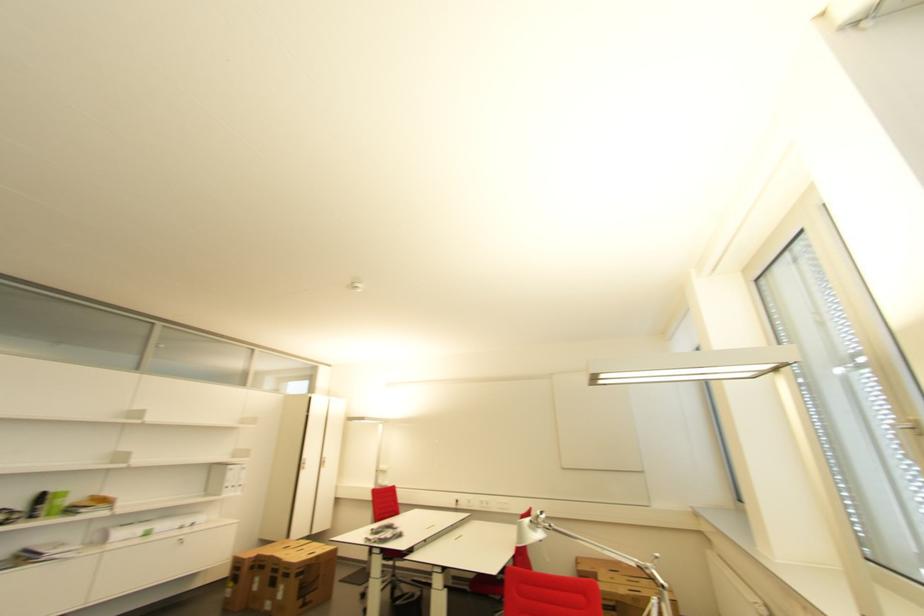
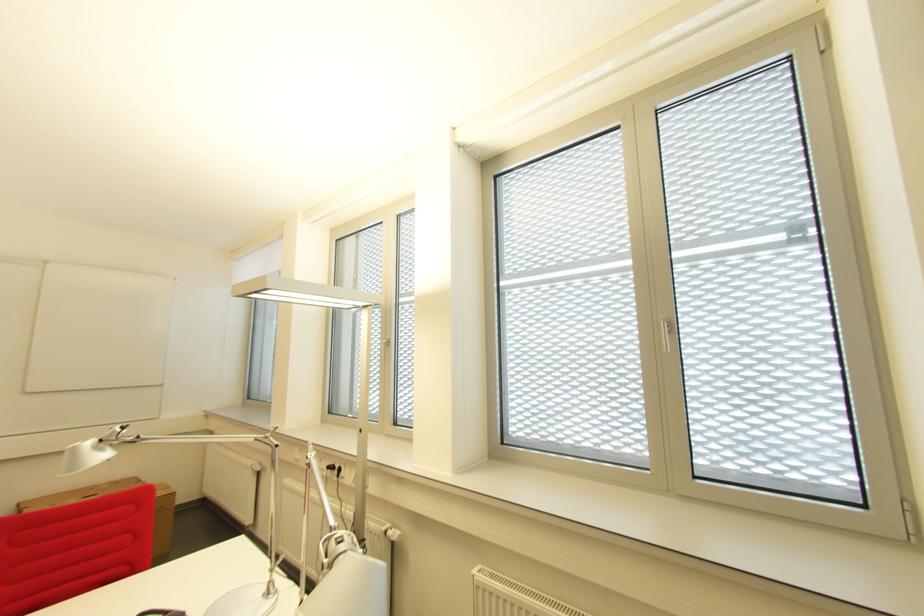
Locate, in the second image, the point that corresponds to pixel 540 527 in the first image.

(106, 447)